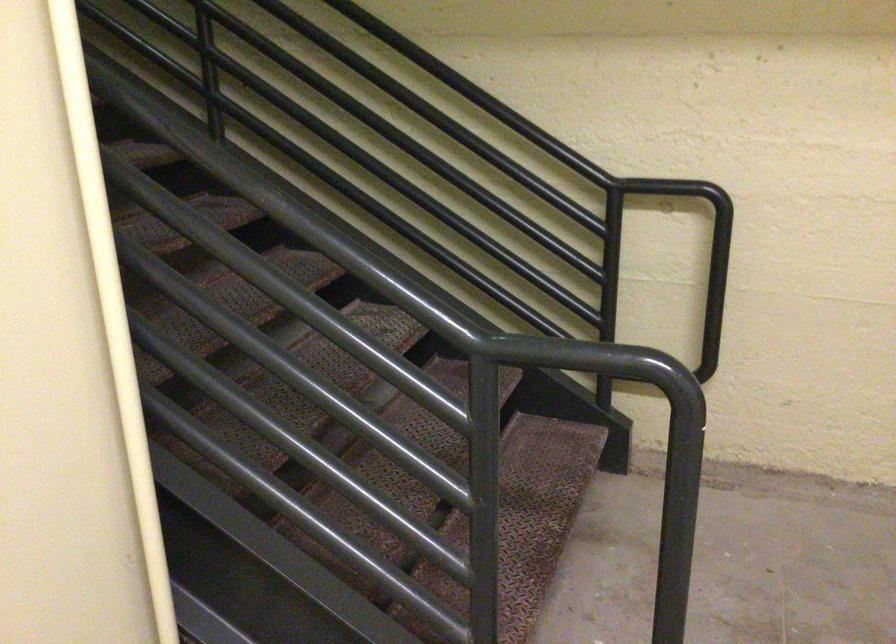
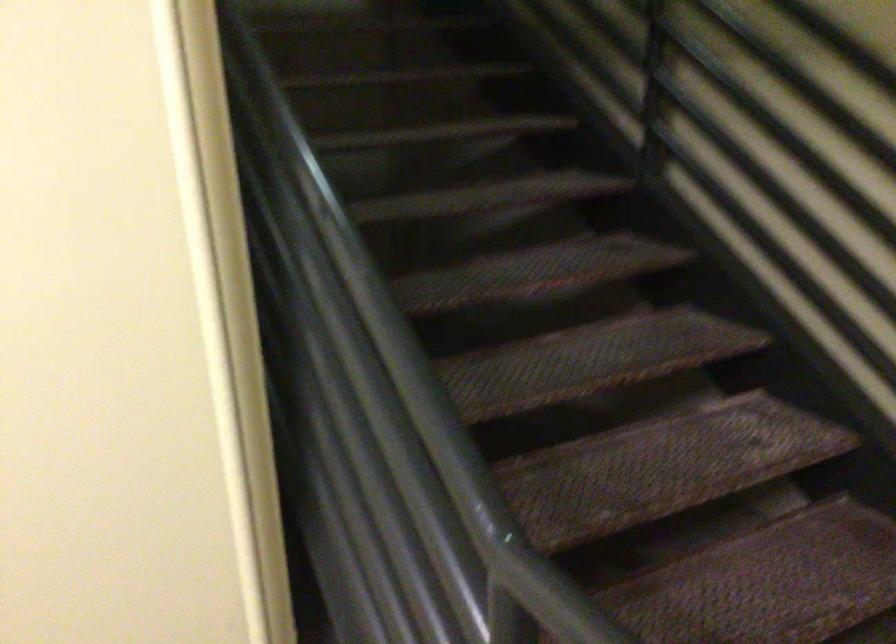
Question: How did the camera likely rotate?

Choices:
 (A) Left
 (B) Right
 (C) Up
 (D) Down

Answer: (A)